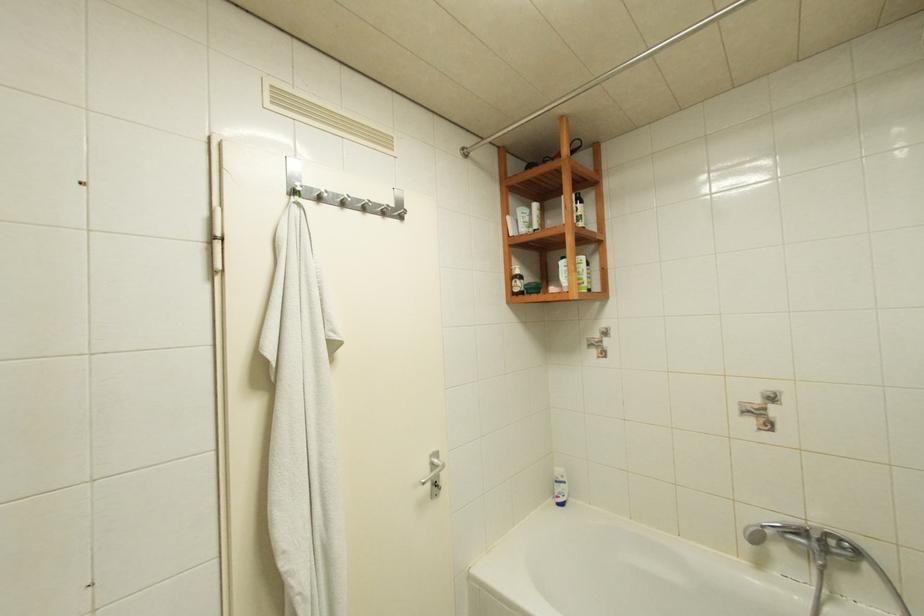
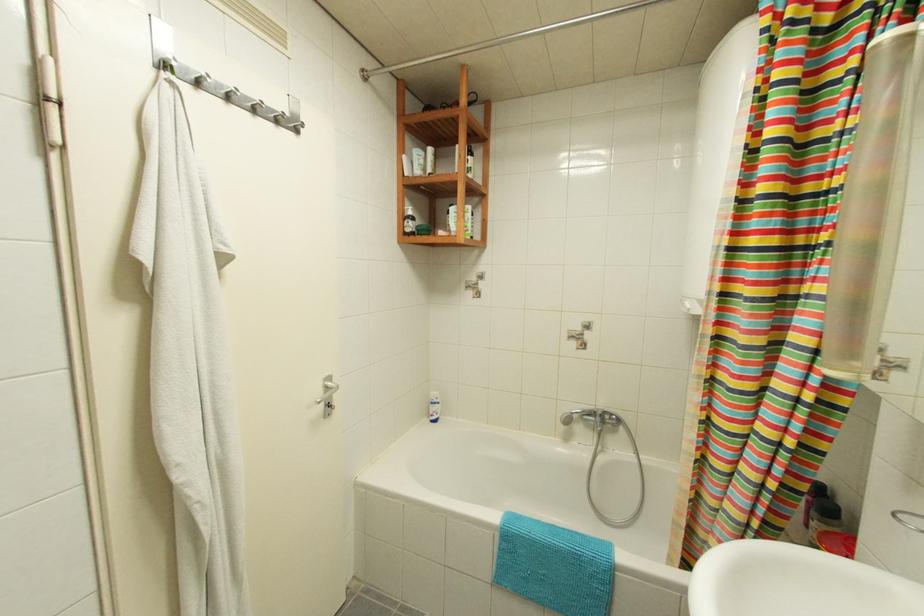
The images are taken continuously from a first-person perspective. In which direction are you moving?

The movement direction of the cameraman is left, backward.